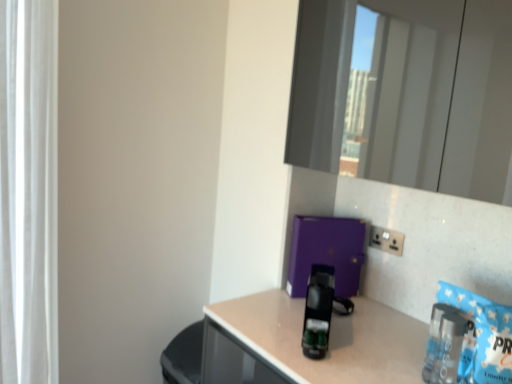
Question: Can you confirm if white sheer curtain at left is wider than black plastic coffee machine at center?

Choices:
 (A) yes
 (B) no

Answer: (B)

Question: Does white sheer curtain at left have a larger size compared to black plastic coffee machine at center?

Choices:
 (A) yes
 (B) no

Answer: (A)

Question: From the image's perspective, would you say white sheer curtain at left is positioned over black plastic coffee machine at center?

Choices:
 (A) yes
 (B) no

Answer: (A)

Question: Is white sheer curtain at left taller than black plastic coffee machine at center?

Choices:
 (A) yes
 (B) no

Answer: (A)

Question: Is white sheer curtain at left to the right of black plastic coffee machine at center from the viewer's perspective?

Choices:
 (A) no
 (B) yes

Answer: (A)

Question: Considering the positions of point (4, 153) and point (370, 238), is point (4, 153) closer or farther from the camera than point (370, 238)?

Choices:
 (A) closer
 (B) farther

Answer: (A)

Question: From their relative heights in the image, would you say white sheer curtain at left is taller or shorter than white plastic electric outlet at upper right?

Choices:
 (A) tall
 (B) short

Answer: (A)

Question: Is white sheer curtain at left to the left or to the right of white plastic electric outlet at upper right in the image?

Choices:
 (A) left
 (B) right

Answer: (A)

Question: Is white sheer curtain at left in front of or behind white plastic electric outlet at upper right in the image?

Choices:
 (A) front
 (B) behind

Answer: (A)

Question: In terms of size, does clear plastic bottle at lower right appear bigger or smaller than white sheer curtain at left?

Choices:
 (A) small
 (B) big

Answer: (A)

Question: Is clear plastic bottle at lower right inside the boundaries of white sheer curtain at left, or outside?

Choices:
 (A) inside
 (B) outside

Answer: (B)

Question: In the image, is clear plastic bottle at lower right on the left side or the right side of white sheer curtain at left?

Choices:
 (A) right
 (B) left

Answer: (A)

Question: From the image's perspective, is clear plastic bottle at lower right above or below white sheer curtain at left?

Choices:
 (A) above
 (B) below

Answer: (B)

Question: From the image's perspective, is black plastic coffee machine at center positioned above or below white plastic electric outlet at upper right?

Choices:
 (A) below
 (B) above

Answer: (A)

Question: From a real-world perspective, is black plastic coffee machine at center positioned above or below white plastic electric outlet at upper right?

Choices:
 (A) below
 (B) above

Answer: (A)